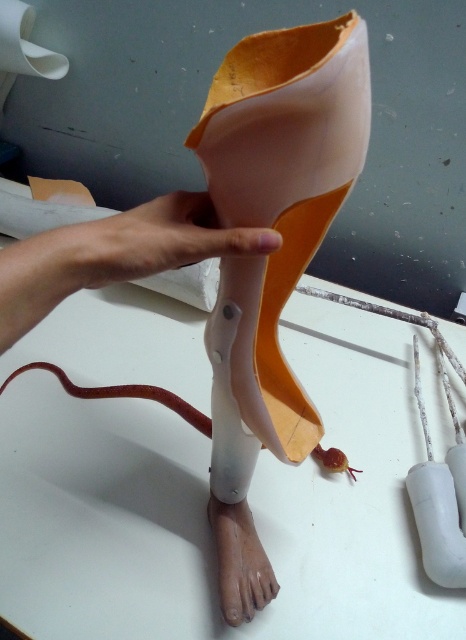
Question: Which point is farther from the camera taking this photo?

Choices:
 (A) (76, 272)
 (B) (244, 598)
 (C) (87, 266)

Answer: (B)

Question: Based on their relative distances, which object is farther from the matte plastic leg at center?

Choices:
 (A) matte plastic foot at lower center
 (B) smooth skin hand at center

Answer: (A)

Question: Does matte plastic leg at center appear on the right side of matte plastic foot at lower center?

Choices:
 (A) no
 (B) yes

Answer: (A)

Question: Is matte plastic leg at center behind matte plastic foot at lower center?

Choices:
 (A) yes
 (B) no

Answer: (B)

Question: Estimate the real-world distances between objects in this image. Which object is farther from the matte plastic foot at lower center?

Choices:
 (A) smooth skin hand at center
 (B) matte plastic leg at center

Answer: (B)

Question: From the image, what is the correct spatial relationship of matte plastic leg at center in relation to matte plastic foot at lower center?

Choices:
 (A) left
 (B) right

Answer: (A)